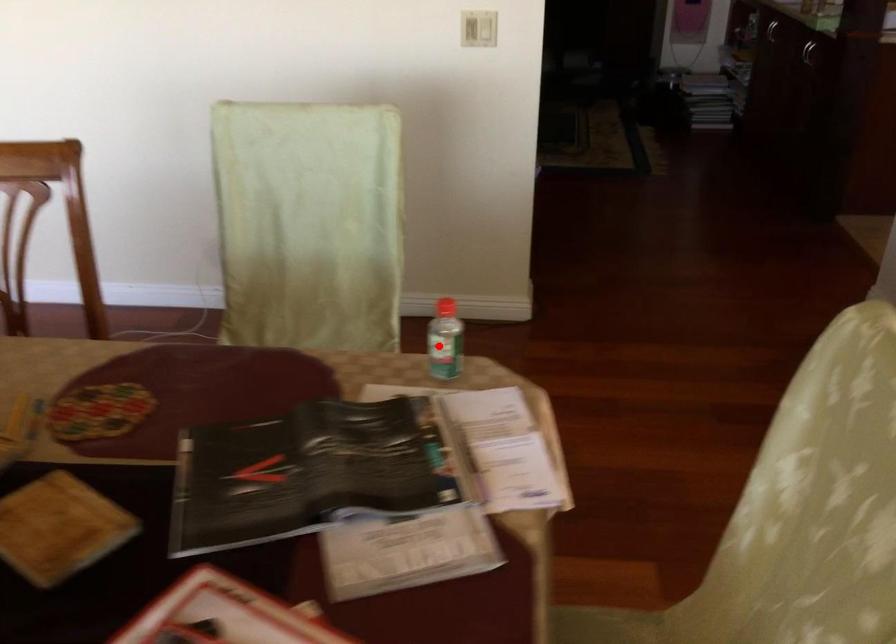
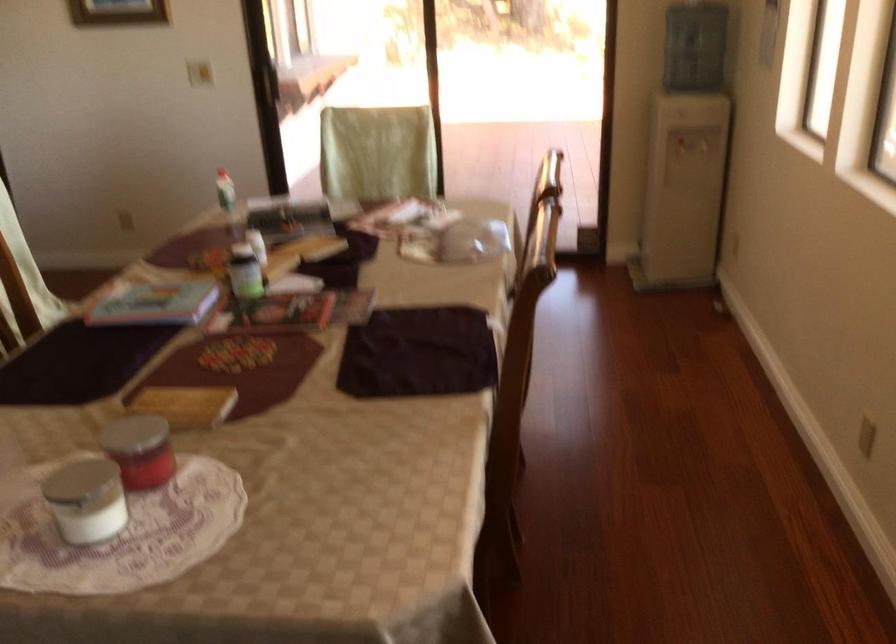
The point at the highlighted location is marked in the first image. Where is the corresponding point in the second image?

(225, 190)